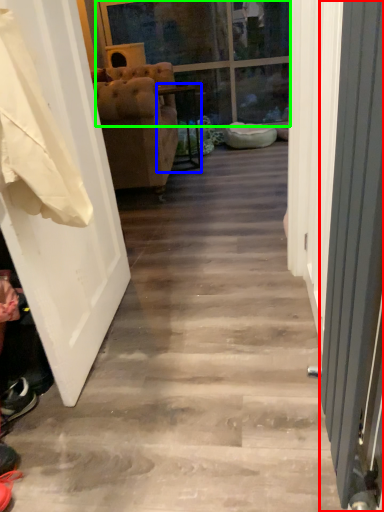
Question: Considering the real-world distances, which object is closest to screen door (highlighted by a red box)? furniture (highlighted by a blue box) or glass door (highlighted by a green box).

Choices:
 (A) furniture
 (B) glass door

Answer: (A)